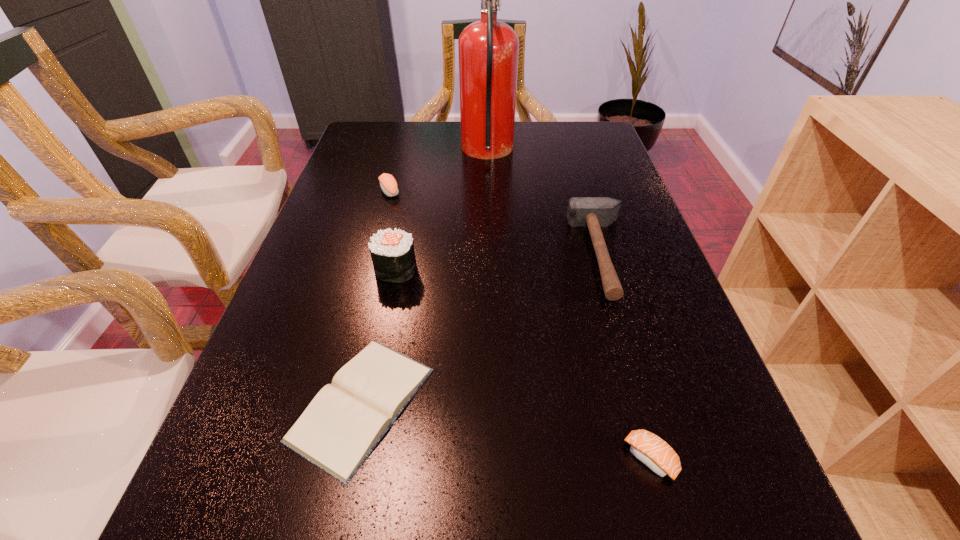
You are a GUI agent. You are given a task and a screenshot of the screen. Output one action in this format:
    pyautogui.click(x=<x>, y=<y>)
    Task: Click on the fifth closest object to the shortest sushi
    
    Given the screenshot: What is the action you would take?
    pyautogui.click(x=388, y=184)

Identify which sushi is located as the nearest to the nearest sushi. Please provide its 2D coordinates. Your answer should be formatted as a tuple, i.e. [(x, y)], where the tuple contains the x and y coordinates of a point satisfying the conditions above.

[(392, 251)]

The image size is (960, 540). I want to click on sushi that stands as the closest to the fifth shortest object, so click(x=388, y=184).

Locate an element on the screen. The image size is (960, 540). free spot that satisfies the following two spatial constraints: 1. on the front side of the Bible; 2. on the left side of the fourth tallest object is located at coordinates (334, 403).

Where is `blank space that satisfies the following two spatial constraints: 1. on the front side of the fourth tallest object; 2. on the right side of the second farthest sushi`? blank space that satisfies the following two spatial constraints: 1. on the front side of the fourth tallest object; 2. on the right side of the second farthest sushi is located at coordinates (370, 269).